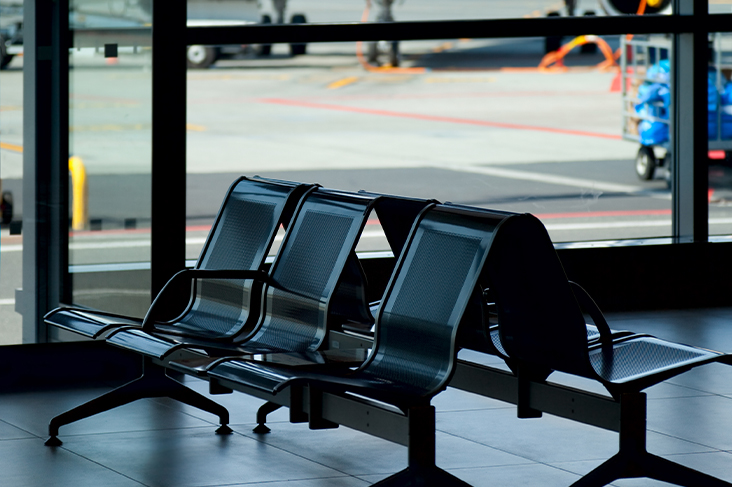
This screenshot has width=732, height=487. I want to click on black floor, so click(x=179, y=464), click(x=545, y=443).